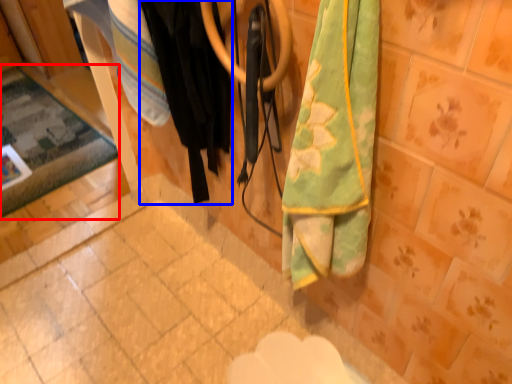
Question: Which object appears farthest to the camera in this image, mat (highlighted by a red box) or clothing (highlighted by a blue box)?

Choices:
 (A) mat
 (B) clothing

Answer: (A)